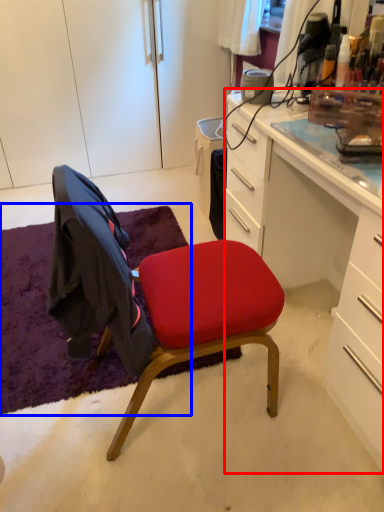
Question: Which of the following is the farthest to the observer, desk (highlighted by a red box) or mat (highlighted by a blue box)?

Choices:
 (A) desk
 (B) mat

Answer: (B)